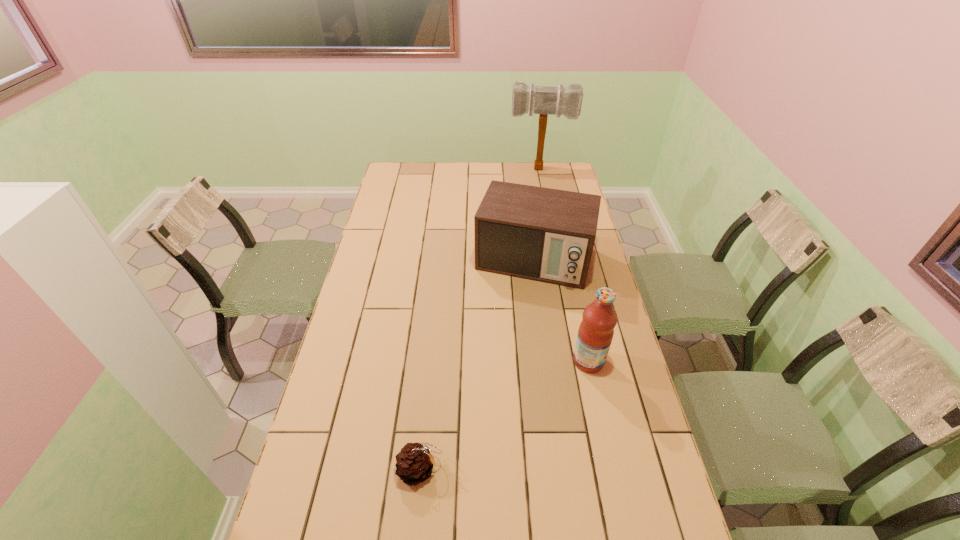
Locate an element on the screen. This screenshot has width=960, height=540. blank area located at the head of the farthest object is located at coordinates (537, 219).

You are a GUI agent. You are given a task and a screenshot of the screen. Output one action in this format:
    pyautogui.click(x=<x>, y=<y>)
    Task: Click on the vacant space located at the head of the farthest object
    The image size is (960, 540).
    Given the screenshot: What is the action you would take?
    pyautogui.click(x=537, y=192)

Identify the location of free space located 0.280m at the head of the farthest object. (537, 206).

Identify the location of free spot located on the front-facing side of the third nearest object. This screenshot has width=960, height=540. (510, 333).

What are the coordinates of `free location located on the front-facing side of the third nearest object` in the screenshot? It's located at (514, 320).

Where is `free location located on the front-facing side of the third nearest object`? free location located on the front-facing side of the third nearest object is located at coordinates (495, 381).

The image size is (960, 540). Identify the location of object that is at the far edge. (542, 100).

What are the coordinates of `fruit juice positioned at the right edge` in the screenshot? It's located at (596, 330).

The width and height of the screenshot is (960, 540). I want to click on mallet located in the right edge section of the desktop, so click(x=542, y=100).

Locate an element on the screen. Image resolution: width=960 pixels, height=540 pixels. radio receiver at the right edge is located at coordinates (543, 234).